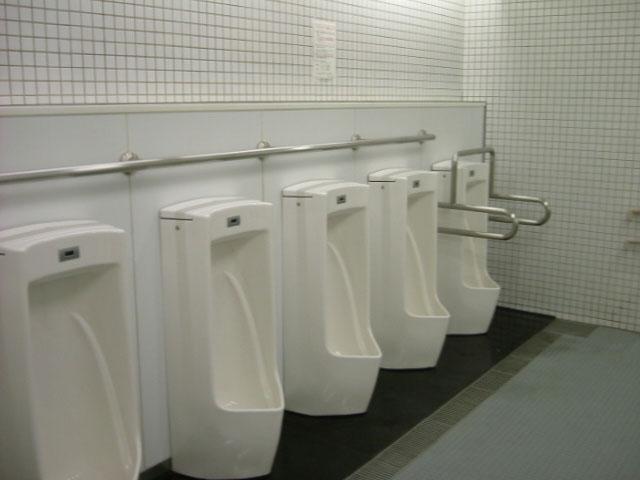
Identify the location of urinal. The height and width of the screenshot is (480, 640). (70, 301), (219, 265), (333, 233), (408, 219), (468, 268).